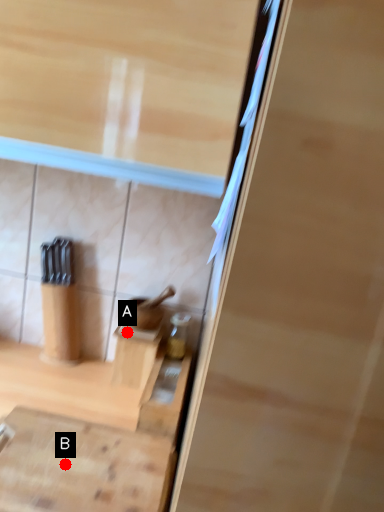
Question: Two points are circled on the image, labeled by A and B beside each circle. Which point is farther from the camera taking this photo?

Choices:
 (A) A is further
 (B) B is further

Answer: (A)